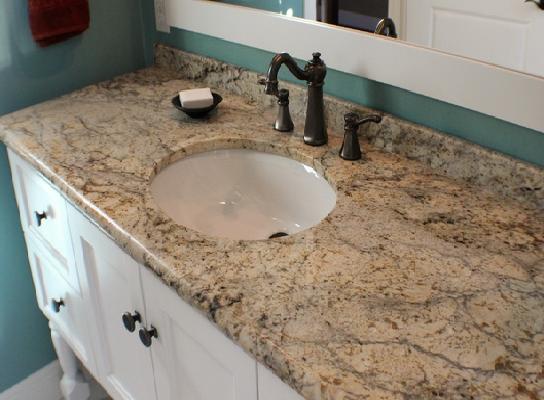
Image resolution: width=544 pixels, height=400 pixels. What are the coordinates of `floor` in the screenshot? It's located at (41, 385).